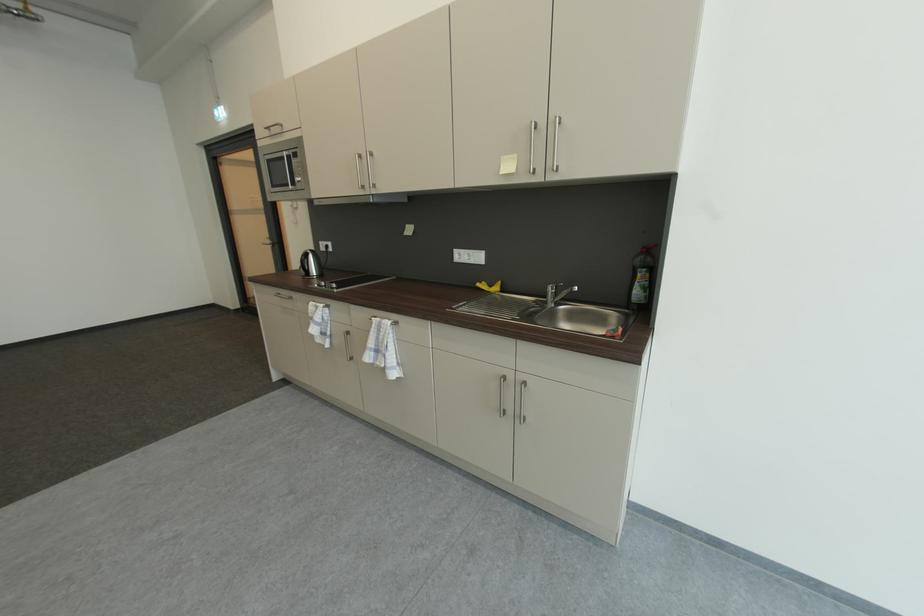
The height and width of the screenshot is (616, 924). What are the coordinates of `yellow sponge` in the screenshot? It's located at (489, 286).